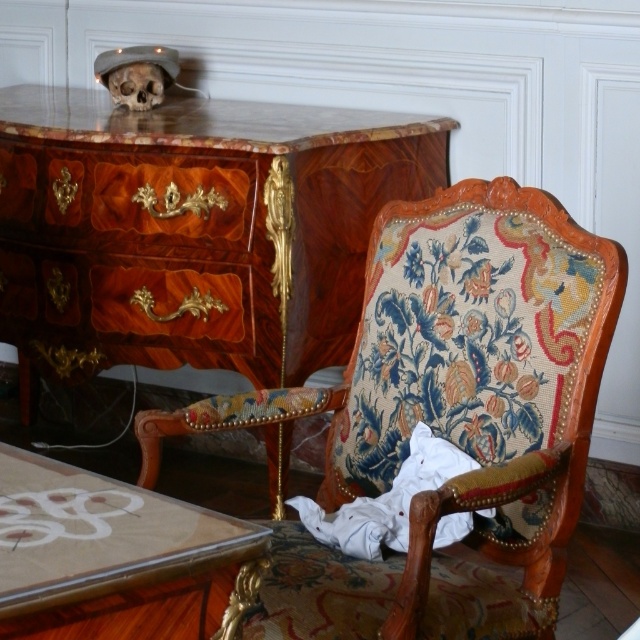
Question: Which point is farther to the camera?

Choices:
 (A) maroon marquetry drawer at center
 (B) bone-like skull at upper left
 (C) translucent glass table at lower left

Answer: (B)

Question: Estimate the real-world distances between objects in this image. Which object is farther from the marble top dresser at left?

Choices:
 (A) bone-like skull at upper left
 (B) maroon marquetry drawer at center
 (C) wooden armchair with floral upholstery at center
 (D) mahogany wood drawer at center

Answer: (C)

Question: Does marble top dresser at left come in front of mahogany wood drawer at center?

Choices:
 (A) no
 (B) yes

Answer: (B)

Question: Estimate the real-world distances between objects in this image. Which object is farther from the maroon marquetry drawer at center?

Choices:
 (A) mahogany wood drawer at center
 (B) bone-like skull at upper left
 (C) translucent glass table at lower left

Answer: (C)

Question: Where is marble top dresser at left located in relation to translucent glass table at lower left in the image?

Choices:
 (A) left
 (B) right

Answer: (B)

Question: Can you confirm if wooden armchair with floral upholstery at center is positioned below translucent glass table at lower left?

Choices:
 (A) yes
 (B) no

Answer: (B)